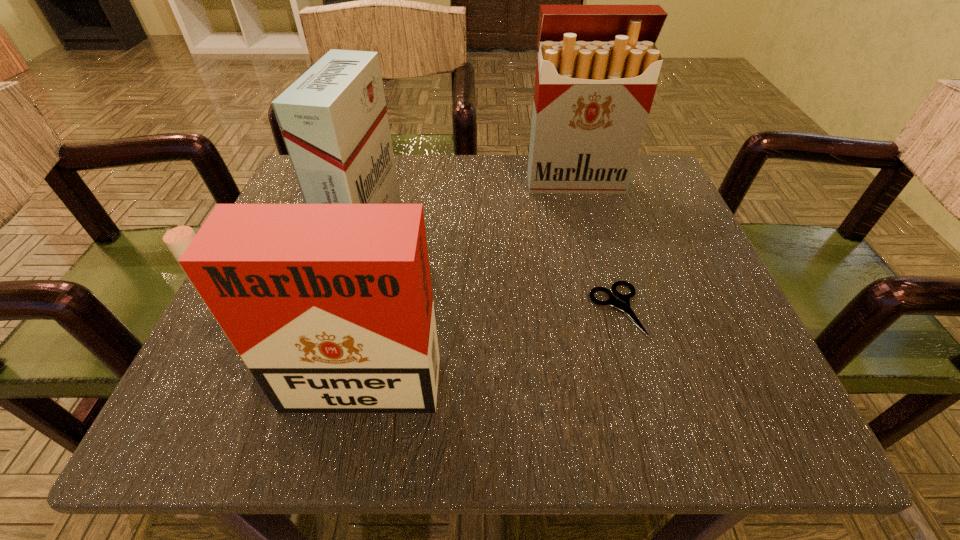
This screenshot has height=540, width=960. I want to click on vacant region at the near right corner of the desktop, so click(683, 402).

In order to click on free space between the shortest object and the rightmost cigarette case in this screenshot , I will do `click(595, 246)`.

Identify the location of free point between the third farthest object and the farthest cigarette case. The width and height of the screenshot is (960, 540). (595, 246).

The width and height of the screenshot is (960, 540). I want to click on vacant area that lies between the shortest object and the nearest cigarette case, so click(480, 347).

Locate an element on the screen. free space between the rightmost cigarette case and the nearest cigarette case is located at coordinates (459, 283).

I want to click on vacant space that's between the shears and the nearest cigarette case, so click(x=480, y=347).

What are the coordinates of `free space between the second nearest cigarette case and the rightmost cigarette case` in the screenshot? It's located at (470, 206).

Locate an element on the screen. The height and width of the screenshot is (540, 960). free space that is in between the shortest object and the nearest object is located at coordinates (480, 347).

Select which object appears as the second closest to the second nearest cigarette case. Please provide its 2D coordinates. Your answer should be formatted as a tuple, i.e. [(x, y)], where the tuple contains the x and y coordinates of a point satisfying the conditions above.

[(597, 68)]

Select which object is the closest to the shortest object. Please provide its 2D coordinates. Your answer should be formatted as a tuple, i.e. [(x, y)], where the tuple contains the x and y coordinates of a point satisfying the conditions above.

[(330, 307)]